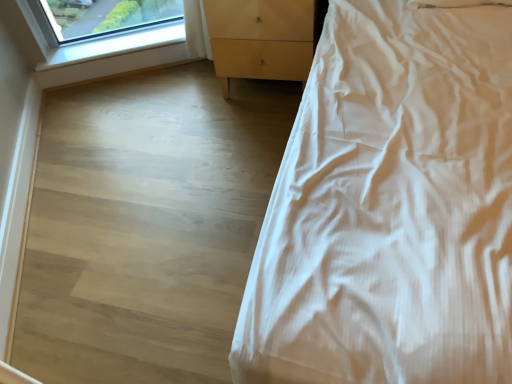
What are the coordinates of `empty space that is ontop of light wood at upper left (from a real-world perspective)` in the screenshot? It's located at (114, 48).